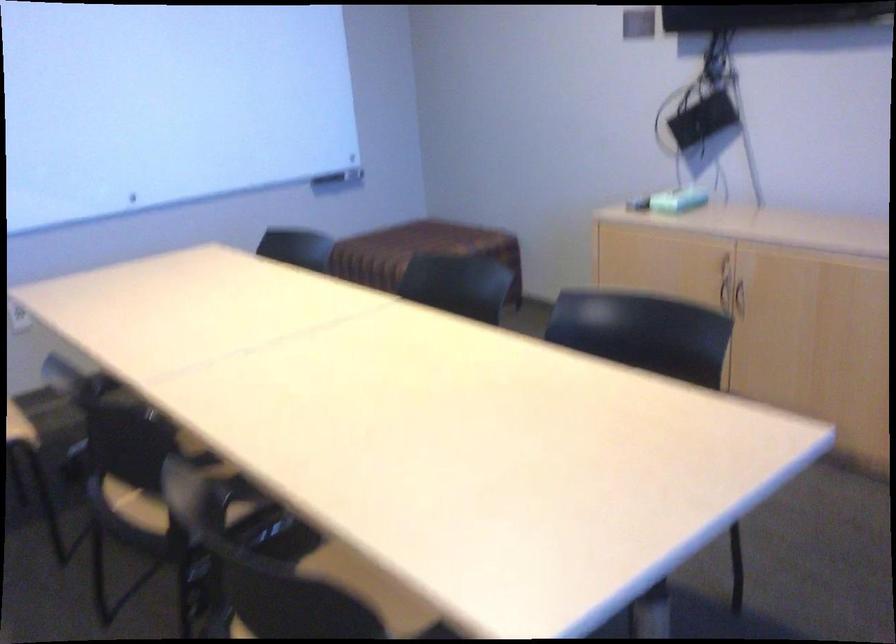
Which object does [677,200] point to?

It refers to a light blue box.